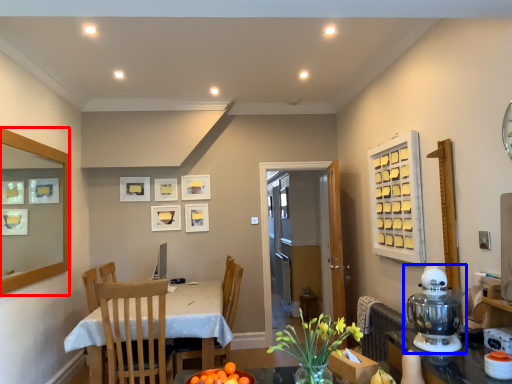
Question: Which object is closer to the camera taking this photo, mirror (highlighted by a red box) or mixer (highlighted by a blue box)?

Choices:
 (A) mirror
 (B) mixer

Answer: (B)